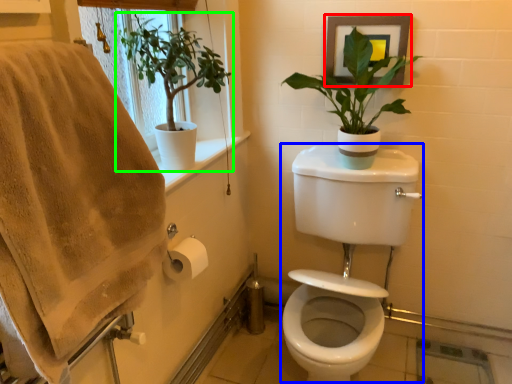
Question: Which object is the farthest from picture frame (highlighted by a red box)? Choose among these: sink (highlighted by a blue box) or houseplant (highlighted by a green box).

Choices:
 (A) sink
 (B) houseplant

Answer: (B)